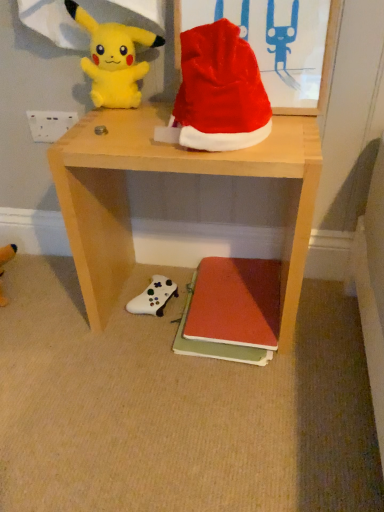
Question: Is shiny fabric santa hat at upper center at the right side of wooden desk at center?

Choices:
 (A) yes
 (B) no

Answer: (A)

Question: Is shiny fabric santa hat at upper center in contact with wooden desk at center?

Choices:
 (A) no
 (B) yes

Answer: (A)

Question: Is shiny fabric santa hat at upper center located outside wooden desk at center?

Choices:
 (A) yes
 (B) no

Answer: (A)

Question: Does shiny fabric santa hat at upper center have a smaller size compared to wooden desk at center?

Choices:
 (A) yes
 (B) no

Answer: (A)

Question: Is shiny fabric santa hat at upper center turned away from wooden desk at center?

Choices:
 (A) yes
 (B) no

Answer: (B)

Question: Looking at their shapes, would you say white plastic power outlet at upper left is wider or thinner than matte red book at lower center?

Choices:
 (A) thin
 (B) wide

Answer: (A)

Question: From the image's perspective, relative to matte red book at lower center, is white plastic power outlet at upper left above or below?

Choices:
 (A) above
 (B) below

Answer: (A)

Question: In terms of height, does white plastic power outlet at upper left look taller or shorter compared to matte red book at lower center?

Choices:
 (A) tall
 (B) short

Answer: (A)

Question: Considering the positions of point (31, 118) and point (240, 280), is point (31, 118) closer or farther from the camera than point (240, 280)?

Choices:
 (A) farther
 (B) closer

Answer: (B)

Question: Would you say matte red book at lower center is to the left or to the right of wooden desk at center in the picture?

Choices:
 (A) right
 (B) left

Answer: (A)

Question: In terms of size, does matte red book at lower center appear bigger or smaller than wooden desk at center?

Choices:
 (A) small
 (B) big

Answer: (A)

Question: Is matte red book at lower center inside the boundaries of wooden desk at center, or outside?

Choices:
 (A) inside
 (B) outside

Answer: (A)

Question: Is point (256, 307) positioned closer to the camera than point (160, 113)?

Choices:
 (A) closer
 (B) farther

Answer: (B)

Question: Considering their positions, is shiny fabric santa hat at upper center located in front of or behind white matte game controller at lower center, which ranks as the first toy in bottom-to-top order?

Choices:
 (A) front
 (B) behind

Answer: (A)

Question: From the image's perspective, relative to white matte game controller at lower center, acting as the second toy starting from the front, is shiny fabric santa hat at upper center above or below?

Choices:
 (A) below
 (B) above

Answer: (B)